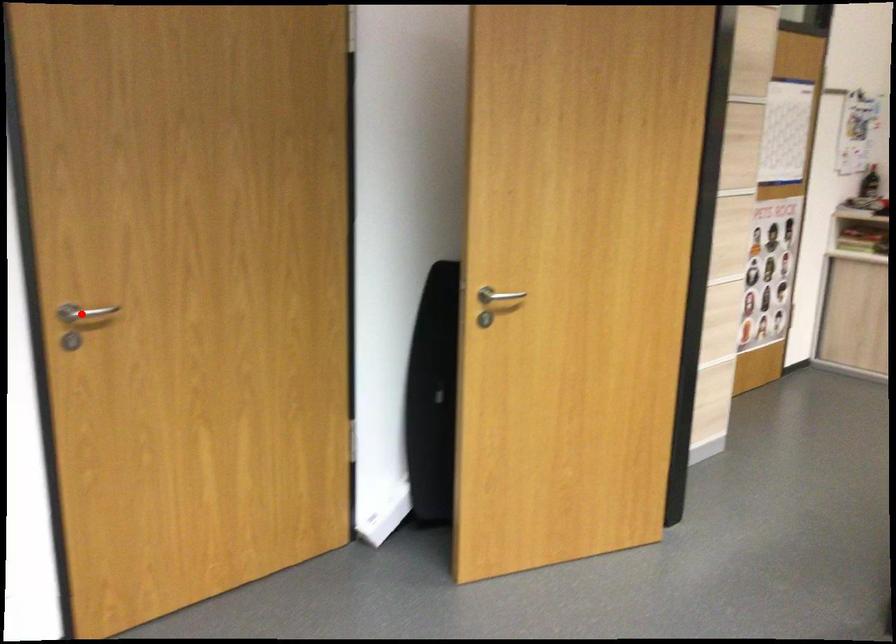
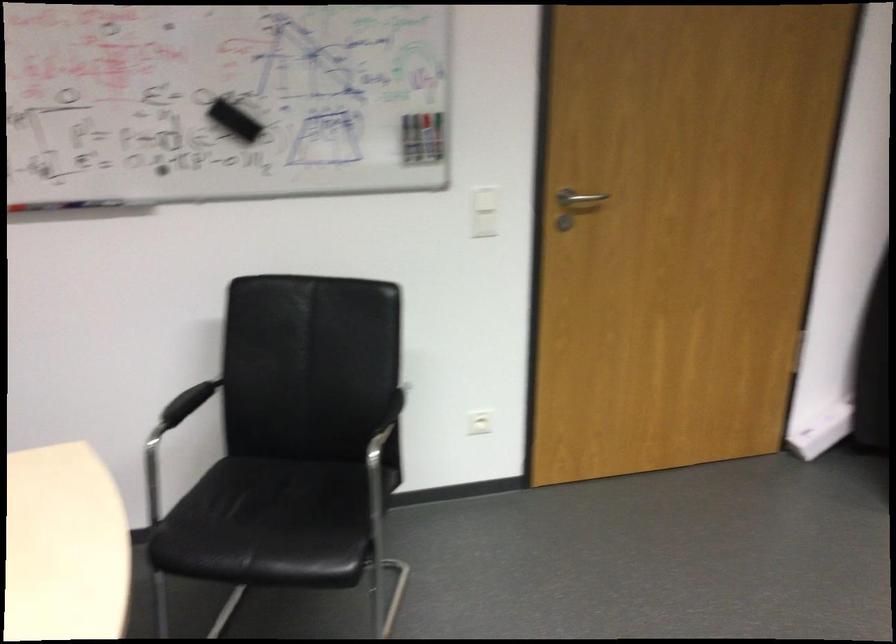
In the second image, find the point that corresponds to the highlighted location in the first image.

(579, 199)